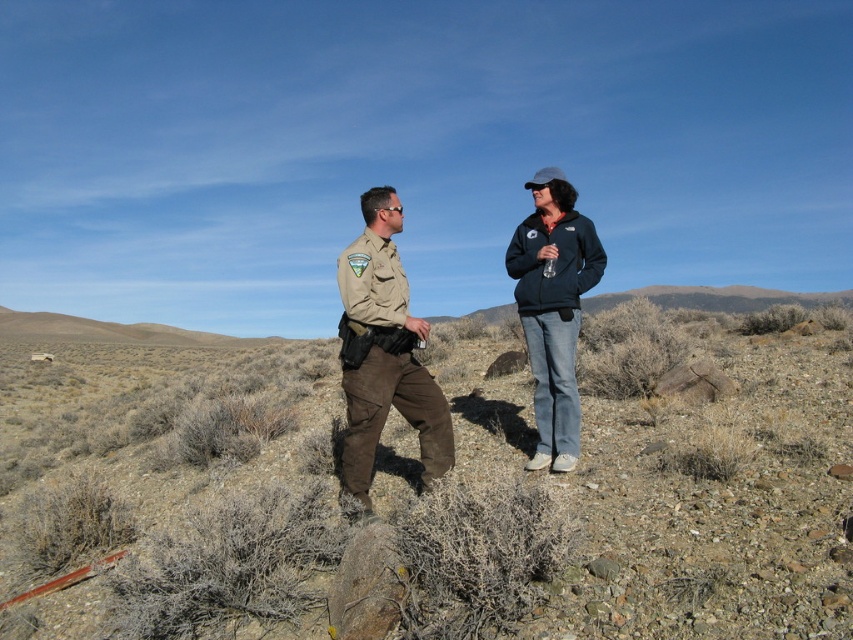
You are a photographer positioned at the edge of the scene. You want to take a photo that includes both the brown dirt at center and the tan uniform at center. Which object will appear larger in the photo?

The brown dirt at center will appear larger in the photo because it is closer to the viewer than the tan uniform at center.

You are planning to take a photo of the two people in the scene. The tan uniform at center and the dark blue fleece jacket at center are both in the frame. Which clothing item appears smaller in the photo?

The tan uniform at center appears smaller in the photo compared to the dark blue fleece jacket at center because the tan uniform at center has a smaller size according to the description.

You are a hiker who has just arrived at this dry, open landscape. You notice the brown dirt at center and the tan uniform at center. Which object is located below the other?

The brown dirt at center is positioned under tan uniform at center, so the dirt is below the uniform.